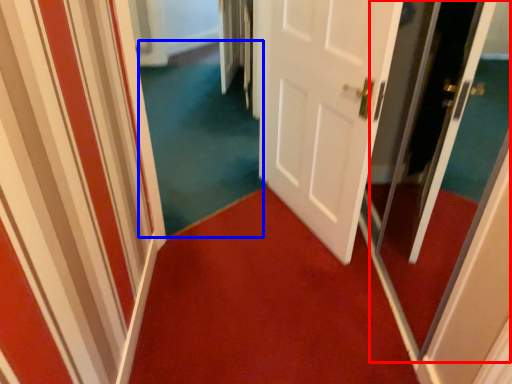
Question: Which object appears farthest to the camera in this image, screen door (highlighted by a red box) or plain (highlighted by a blue box)?

Choices:
 (A) screen door
 (B) plain

Answer: (B)